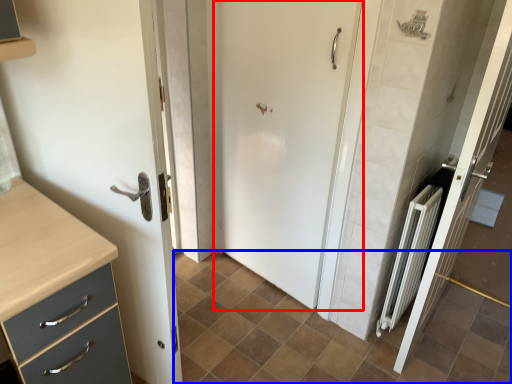
Question: Which point is further to the camera, door (highlighted by a red box) or ceramic tile (highlighted by a blue box)?

Choices:
 (A) door
 (B) ceramic tile

Answer: (A)